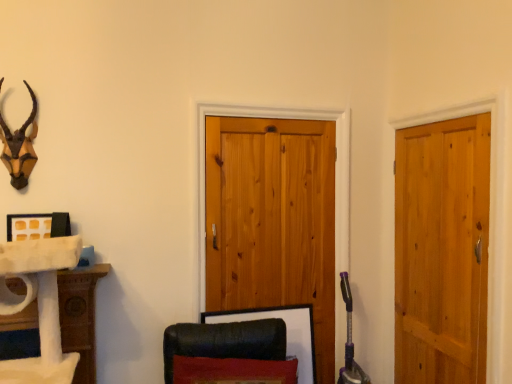
Question: Considering the relative sizes of light brown wooden door at right and wooden picture frame at lower center in the image provided, is light brown wooden door at right shorter than wooden picture frame at lower center?

Choices:
 (A) yes
 (B) no

Answer: (B)

Question: From a real-world perspective, is light brown wooden door at right located higher than wooden picture frame at lower center?

Choices:
 (A) no
 (B) yes

Answer: (B)

Question: From the image's perspective, is light brown wooden door at right above wooden picture frame at lower center?

Choices:
 (A) no
 (B) yes

Answer: (B)

Question: Is light brown wooden door at right to the left of wooden picture frame at lower center from the viewer's perspective?

Choices:
 (A) no
 (B) yes

Answer: (A)

Question: Considering the relative sizes of light brown wooden door at right and wooden picture frame at lower center in the image provided, is light brown wooden door at right wider than wooden picture frame at lower center?

Choices:
 (A) yes
 (B) no

Answer: (B)

Question: Considering the positions of light brown wooden door at right and natural wood barn door at center in the image, is light brown wooden door at right bigger or smaller than natural wood barn door at center?

Choices:
 (A) small
 (B) big

Answer: (A)

Question: Is light brown wooden door at right in front of or behind natural wood barn door at center in the image?

Choices:
 (A) behind
 (B) front

Answer: (B)

Question: Considering the positions of point click(x=438, y=261) and point click(x=306, y=192), is point click(x=438, y=261) closer or farther from the camera than point click(x=306, y=192)?

Choices:
 (A) closer
 (B) farther

Answer: (A)

Question: From a real-world perspective, is light brown wooden door at right above or below natural wood barn door at center?

Choices:
 (A) below
 (B) above

Answer: (A)

Question: From the image's perspective, relative to wooden picture frame at lower center, is light brown wooden door at right above or below?

Choices:
 (A) below
 (B) above

Answer: (B)

Question: Considering the positions of light brown wooden door at right and wooden picture frame at lower center in the image, is light brown wooden door at right wider or thinner than wooden picture frame at lower center?

Choices:
 (A) thin
 (B) wide

Answer: (A)

Question: Based on their positions, is light brown wooden door at right located to the left or right of wooden picture frame at lower center?

Choices:
 (A) left
 (B) right

Answer: (B)

Question: Is point (410, 192) positioned closer to the camera than point (311, 316)?

Choices:
 (A) farther
 (B) closer

Answer: (B)

Question: In terms of height, does wooden picture frame at lower center look taller or shorter compared to natural wood barn door at center?

Choices:
 (A) short
 (B) tall

Answer: (A)

Question: In the image, is wooden picture frame at lower center on the left side or the right side of natural wood barn door at center?

Choices:
 (A) right
 (B) left

Answer: (B)